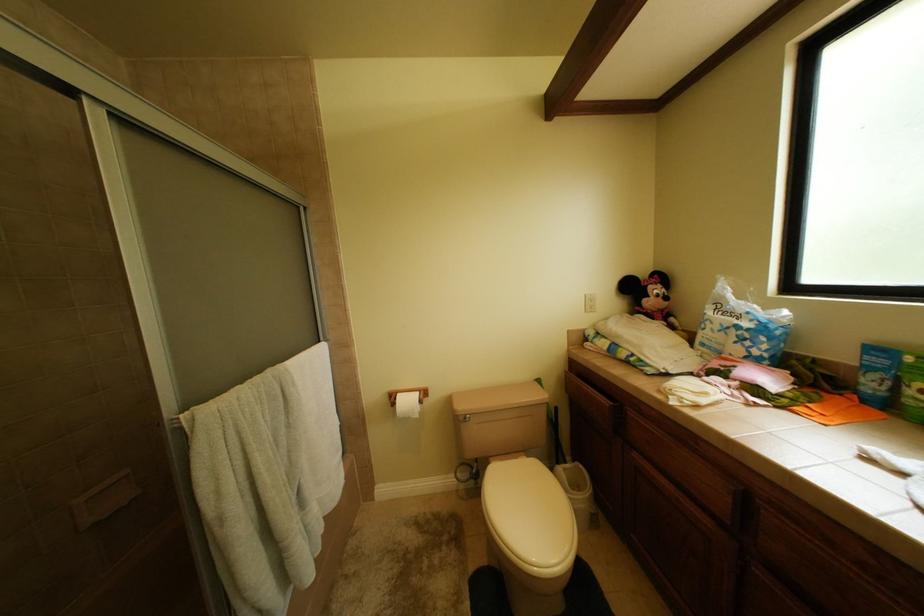
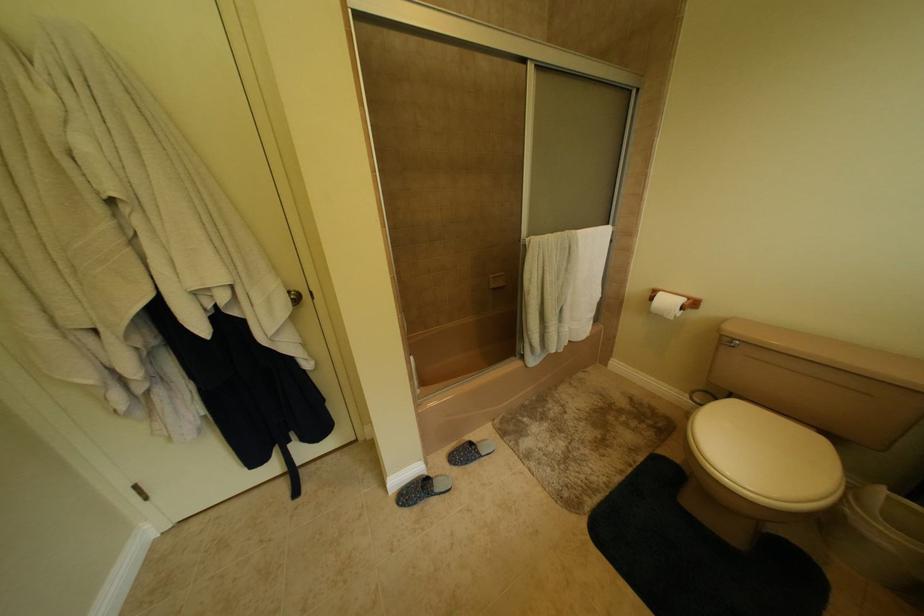
The images are taken continuously from a first-person perspective. In which direction is your viewpoint rotating?

The camera rotated toward left-down.